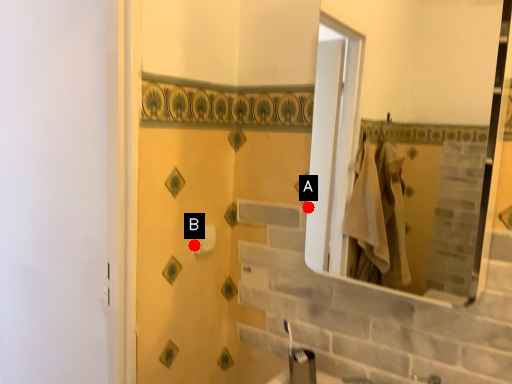
Question: Two points are circled on the image, labeled by A and B beside each circle. Which point is closer to the camera taking this photo?

Choices:
 (A) A is closer
 (B) B is closer

Answer: (B)